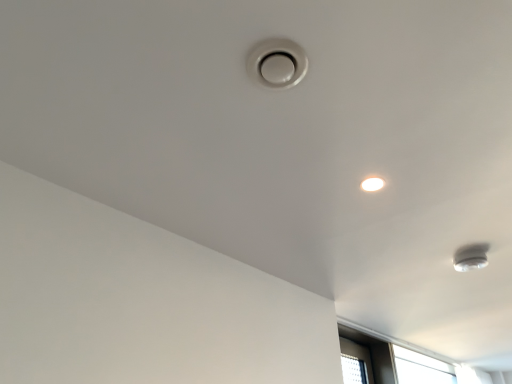
Identify the location of white glossy droplight at upper right. This screenshot has height=384, width=512. (372, 184).

What do you see at coordinates (372, 184) in the screenshot?
I see `white glossy droplight at upper right` at bounding box center [372, 184].

The width and height of the screenshot is (512, 384). Find the location of `white glossy lamp at lower right`. white glossy lamp at lower right is located at coordinates (471, 257).

The height and width of the screenshot is (384, 512). What do you see at coordinates (471, 257) in the screenshot?
I see `white glossy lamp at lower right` at bounding box center [471, 257].

Image resolution: width=512 pixels, height=384 pixels. What are the coordinates of `white glossy droplight at upper right` in the screenshot? It's located at (372, 184).

Is white glossy lamp at lower right at the left side of white glossy droplight at upper right?

No, white glossy lamp at lower right is not to the left of white glossy droplight at upper right.

Relative to white glossy droplight at upper right, is white glossy lamp at lower right in front or behind?

white glossy lamp at lower right is behind white glossy droplight at upper right.

Does point (485, 261) lie in front of point (374, 179)?

No.

From the image's perspective, is white glossy lamp at lower right over white glossy droplight at upper right?

No, from the image's perspective, white glossy lamp at lower right is not over white glossy droplight at upper right.

Looking at this image, from a real-world perspective, does white glossy lamp at lower right sit lower than white glossy droplight at upper right?

Yes, from a real-world perspective, white glossy lamp at lower right is below white glossy droplight at upper right.

Between white glossy lamp at lower right and white glossy droplight at upper right, which one has larger width?

white glossy lamp at lower right is wider.

From their relative heights in the image, would you say white glossy lamp at lower right is taller or shorter than white glossy droplight at upper right?

white glossy lamp at lower right is taller than white glossy droplight at upper right.

Is white glossy lamp at lower right smaller than white glossy droplight at upper right?

No, white glossy lamp at lower right is not smaller than white glossy droplight at upper right.

Is white glossy lamp at lower right not inside white glossy droplight at upper right?

Yes.

Does white glossy lamp at lower right touch white glossy droplight at upper right?

No, white glossy lamp at lower right is not touching white glossy droplight at upper right.

Is white glossy lamp at lower right facing away from white glossy droplight at upper right?

white glossy lamp at lower right does not have its back to white glossy droplight at upper right.

Measure the distance between white glossy lamp at lower right and white glossy droplight at upper right.

32.77 inches.

Where is `lamp beneath the white glossy droplight at upper right (from a real-world perspective)`? lamp beneath the white glossy droplight at upper right (from a real-world perspective) is located at coordinates click(x=471, y=257).

Between white glossy droplight at upper right and white glossy lamp at lower right, which one appears on the left side from the viewer's perspective?

From the viewer's perspective, white glossy droplight at upper right appears more on the left side.

Which object is further away from the camera taking this photo, white glossy droplight at upper right or white glossy lamp at lower right?

white glossy lamp at lower right.

Is point (376, 187) behind point (456, 269)?

No, (376, 187) is closer to viewer.

From the image's perspective, would you say white glossy droplight at upper right is shown under white glossy lamp at lower right?

Incorrect, from the image's perspective, white glossy droplight at upper right is higher than white glossy lamp at lower right.

From a real-world perspective, relative to white glossy lamp at lower right, is white glossy droplight at upper right vertically above or below?

white glossy droplight at upper right is above white glossy lamp at lower right.

Between white glossy droplight at upper right and white glossy lamp at lower right, which one has larger width?

white glossy lamp at lower right is wider.

Does white glossy droplight at upper right have a lesser height compared to white glossy lamp at lower right?

Yes, white glossy droplight at upper right is shorter than white glossy lamp at lower right.

Between white glossy droplight at upper right and white glossy lamp at lower right, which one has smaller size?

Smaller between the two is white glossy droplight at upper right.

Would you say white glossy droplight at upper right is inside or outside white glossy lamp at lower right?

white glossy droplight at upper right is not enclosed by white glossy lamp at lower right.

Is white glossy droplight at upper right not near white glossy lamp at lower right?

No, white glossy droplight at upper right is in close proximity to white glossy lamp at lower right.

Is white glossy droplight at upper right positioned with its back to white glossy lamp at lower right?

No, white glossy lamp at lower right is not at the back of white glossy droplight at upper right.

Measure the distance between white glossy droplight at upper right and white glossy lamp at lower right.

white glossy droplight at upper right is 83.24 centimeters from white glossy lamp at lower right.

Where is `lamp on the right of white glossy droplight at upper right`? Image resolution: width=512 pixels, height=384 pixels. lamp on the right of white glossy droplight at upper right is located at coordinates (471, 257).

Identify the location of droplight above the white glossy lamp at lower right (from a real-world perspective). The width and height of the screenshot is (512, 384). (372, 184).

At what (x,y) coordinates should I click in order to perform the action: click on lamp behind the white glossy droplight at upper right. Please return your answer as a coordinate pair (x, y). The width and height of the screenshot is (512, 384). Looking at the image, I should click on (471, 257).